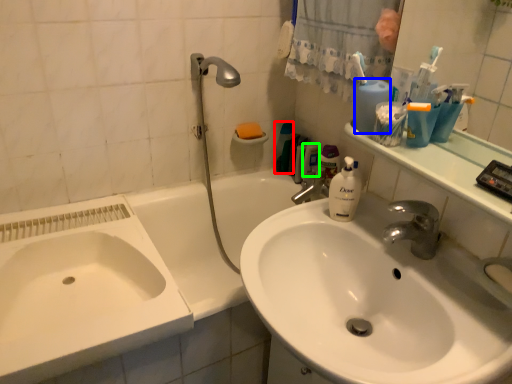
Question: Based on their relative distances, which object is nearer to mouthwash (highlighted by a red box)? Choose from cleaning product (highlighted by a blue box) and mouthwash (highlighted by a green box).

Choices:
 (A) cleaning product
 (B) mouthwash

Answer: (B)